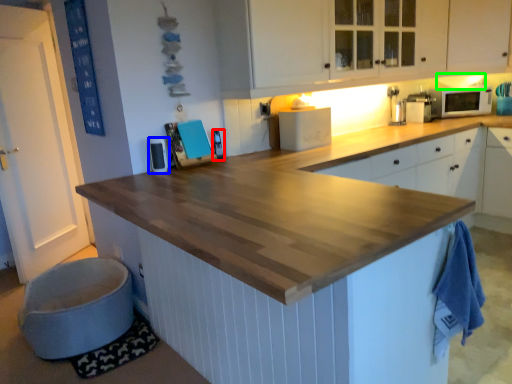
Question: Which is farther away from appliance (highlighted by a red box)? appliance (highlighted by a blue box) or exhaust hood (highlighted by a green box)?

Choices:
 (A) appliance
 (B) exhaust hood

Answer: (B)